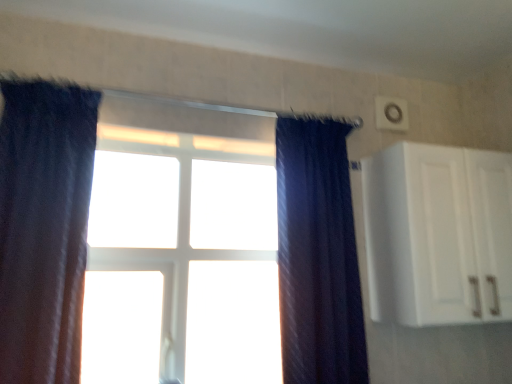
Identify the location of white plastic window at center. (181, 262).

Describe the element at coordinates (181, 262) in the screenshot. The image size is (512, 384). I see `white plastic window at center` at that location.

In order to click on dark blue textured curtain at center, acting as the 1th curtain starting from the right in this screenshot , I will do [x=318, y=255].

Between dark blue textured curtain at center, acting as the 1th curtain starting from the right, and white plastic window at center, which one is positioned in front?

dark blue textured curtain at center, acting as the 1th curtain starting from the right, is in front.

Is dark blue textured curtain at center, acting as the 1th curtain starting from the right, far from white plastic window at center?

Actually, dark blue textured curtain at center, acting as the 1th curtain starting from the right, and white plastic window at center are a little close together.

From the image's perspective, is dark blue textured curtain at center, the second curtain from the left, on white plastic window at center?

Yes.

Which object is wider, dark blue textured curtain at center, the second curtain from the left, or white matte cabinet at upper right?

With larger width is white matte cabinet at upper right.

Is dark blue textured curtain at center, acting as the 1th curtain starting from the right, at the right side of white matte cabinet at upper right?

No.

Which is in front, dark blue textured curtain at center, the second curtain from the left, or white matte cabinet at upper right?

dark blue textured curtain at center, the second curtain from the left, is more forward.

From the image's perspective, between dark blue textured curtain at center, the second curtain from the left, and white matte cabinet at upper right, which one is located above?

white matte cabinet at upper right, from the image's perspective.

From a real-world perspective, is dark blue velvet curtain at left, which is the first curtain from left to right, on white matte cabinet at upper right?

No, from a real-world perspective, dark blue velvet curtain at left, which is the first curtain from left to right, is not over white matte cabinet at upper right

How different are the orientations of dark blue velvet curtain at left, which is the first curtain from left to right, and white matte cabinet at upper right in degrees?

0.891 degrees.

Can you see dark blue velvet curtain at left, which is the first curtain from left to right, touching white matte cabinet at upper right?

dark blue velvet curtain at left, which is the first curtain from left to right, and white matte cabinet at upper right are not in contact.

Between dark blue velvet curtain at left, which is the first curtain from left to right, and white matte cabinet at upper right, which one has larger width?

With larger width is white matte cabinet at upper right.

Is dark blue velvet curtain at left, which is the first curtain from left to right, in front of or behind dark blue textured curtain at center, the second curtain from the left, in the image?

dark blue velvet curtain at left, which is the first curtain from left to right, is in front of dark blue textured curtain at center, the second curtain from the left.

Is there a large distance between dark blue velvet curtain at left, the 2th curtain from the right, and dark blue textured curtain at center, acting as the 1th curtain starting from the right?

dark blue velvet curtain at left, the 2th curtain from the right, is actually quite close to dark blue textured curtain at center, acting as the 1th curtain starting from the right.

Can you tell me how much dark blue velvet curtain at left, which is the first curtain from left to right, and dark blue textured curtain at center, the second curtain from the left, differ in facing direction?

The facing directions of dark blue velvet curtain at left, which is the first curtain from left to right, and dark blue textured curtain at center, the second curtain from the left, are 0.891 degrees apart.

Is dark blue textured curtain at center, acting as the 1th curtain starting from the right, at the back of dark blue velvet curtain at left, which is the first curtain from left to right?

dark blue velvet curtain at left, which is the first curtain from left to right, is not turned away from dark blue textured curtain at center, acting as the 1th curtain starting from the right.

Between white matte cabinet at upper right and dark blue textured curtain at center, the second curtain from the left, which one has less height?

Standing shorter between the two is white matte cabinet at upper right.

Can you confirm if white matte cabinet at upper right is thinner than dark blue textured curtain at center, the second curtain from the left?

No.

Considering the sizes of white matte cabinet at upper right and dark blue textured curtain at center, the second curtain from the left, in the image, is white matte cabinet at upper right bigger or smaller than dark blue textured curtain at center, the second curtain from the left,?

In the image, white matte cabinet at upper right appears to be larger than dark blue textured curtain at center, the second curtain from the left.

Does dark blue velvet curtain at left, the 2th curtain from the right, have a greater height compared to white plastic window at center?

In fact, dark blue velvet curtain at left, the 2th curtain from the right, may be shorter than white plastic window at center.

Considering the relative sizes of dark blue velvet curtain at left, which is the first curtain from left to right, and white plastic window at center in the image provided, is dark blue velvet curtain at left, which is the first curtain from left to right, smaller than white plastic window at center?

Incorrect, dark blue velvet curtain at left, which is the first curtain from left to right, is not smaller in size than white plastic window at center.

From the image's perspective, does dark blue velvet curtain at left, which is the first curtain from left to right, appear higher than white plastic window at center?

Yes, from the image's perspective, dark blue velvet curtain at left, which is the first curtain from left to right, is above white plastic window at center.

How far apart are dark blue velvet curtain at left, the 2th curtain from the right, and white plastic window at center?

A distance of 17.65 inches exists between dark blue velvet curtain at left, the 2th curtain from the right, and white plastic window at center.

Can you see white matte cabinet at upper right touching white plastic window at center?

No, white matte cabinet at upper right is not beside white plastic window at center.

From a real-world perspective, which is physically above, white matte cabinet at upper right or white plastic window at center?

white matte cabinet at upper right.

From the image's perspective, which is above, white matte cabinet at upper right or white plastic window at center?

white matte cabinet at upper right.

Between white matte cabinet at upper right and white plastic window at center, which one has more height?

white plastic window at center is taller.

The height and width of the screenshot is (384, 512). What are the coordinates of `bay window that appears on the left of dark blue textured curtain at center, acting as the 1th curtain starting from the right` in the screenshot? It's located at (181, 262).

This screenshot has width=512, height=384. Identify the location of cabinetry behind the dark blue textured curtain at center, acting as the 1th curtain starting from the right. (438, 234).

Based on the photo, considering their positions, is dark blue velvet curtain at left, which is the first curtain from left to right, positioned closer to dark blue textured curtain at center, the second curtain from the left, than white matte cabinet at upper right?

white matte cabinet at upper right lies closer to dark blue textured curtain at center, the second curtain from the left, than the other object.

Considering their positions, is dark blue textured curtain at center, acting as the 1th curtain starting from the right, positioned further to white plastic window at center than white matte cabinet at upper right?

white matte cabinet at upper right is positioned further to the anchor white plastic window at center.

Which object lies nearer to the anchor point white plastic window at center, white matte cabinet at upper right or dark blue textured curtain at center, the second curtain from the left?

Based on the image, dark blue textured curtain at center, the second curtain from the left, appears to be nearer to white plastic window at center.

Looking at this image, based on their spatial positions, is white plastic window at center or dark blue textured curtain at center, acting as the 1th curtain starting from the right, further from dark blue velvet curtain at left, which is the first curtain from left to right?

dark blue textured curtain at center, acting as the 1th curtain starting from the right.

From the image, which object appears to be nearer to dark blue velvet curtain at left, which is the first curtain from left to right, white matte cabinet at upper right or dark blue textured curtain at center, acting as the 1th curtain starting from the right?

Among the two, dark blue textured curtain at center, acting as the 1th curtain starting from the right, is located nearer to dark blue velvet curtain at left, which is the first curtain from left to right.

Which object lies nearer to the anchor point white matte cabinet at upper right, dark blue velvet curtain at left, the 2th curtain from the right, or white plastic window at center?

white plastic window at center.

Which object lies nearer to the anchor point dark blue textured curtain at center, acting as the 1th curtain starting from the right, white matte cabinet at upper right or dark blue velvet curtain at left, which is the first curtain from left to right?

Among the two, white matte cabinet at upper right is located nearer to dark blue textured curtain at center, acting as the 1th curtain starting from the right.

When comparing their distances from white plastic window at center, does white matte cabinet at upper right or dark blue velvet curtain at left, the 2th curtain from the right, seem closer?

Among the two, dark blue velvet curtain at left, the 2th curtain from the right, is located nearer to white plastic window at center.

The height and width of the screenshot is (384, 512). I want to click on bay window between dark blue velvet curtain at left, which is the first curtain from left to right, and white matte cabinet at upper right, in the horizontal direction, so click(x=181, y=262).

This screenshot has width=512, height=384. What are the coordinates of `curtain between white plastic window at center and white matte cabinet at upper right in the horizontal direction` in the screenshot? It's located at (318, 255).

Where is `bay window located between dark blue velvet curtain at left, the 2th curtain from the right, and dark blue textured curtain at center, acting as the 1th curtain starting from the right, in the left-right direction`? bay window located between dark blue velvet curtain at left, the 2th curtain from the right, and dark blue textured curtain at center, acting as the 1th curtain starting from the right, in the left-right direction is located at coordinates (181, 262).

At what (x,y) coordinates should I click in order to perform the action: click on curtain located between dark blue velvet curtain at left, which is the first curtain from left to right, and white matte cabinet at upper right in the left-right direction. Please return your answer as a coordinate pair (x, y). This screenshot has width=512, height=384. Looking at the image, I should click on (318, 255).